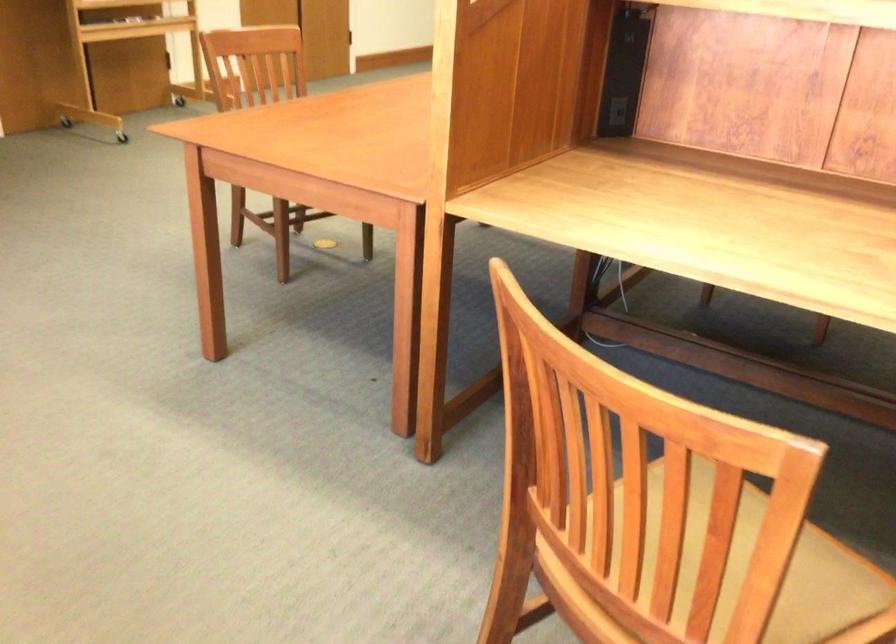
Image resolution: width=896 pixels, height=644 pixels. I want to click on chair sitting surface, so click(x=833, y=594).